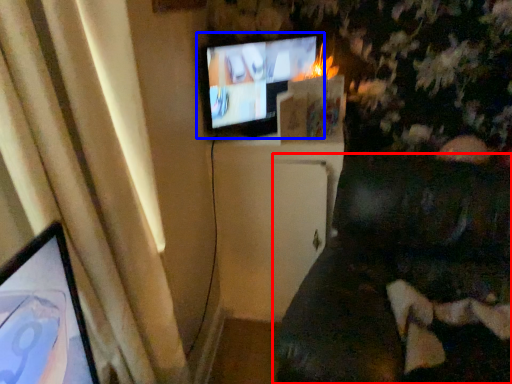
Question: Which point is closer to the camera, furniture (highlighted by a red box) or television (highlighted by a blue box)?

Choices:
 (A) furniture
 (B) television

Answer: (A)